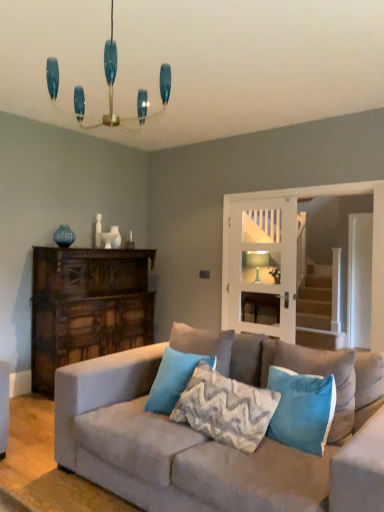
Where is `blank space above white glass door at center (from a real-world perspective)`? This screenshot has height=512, width=384. blank space above white glass door at center (from a real-world perspective) is located at coordinates (262, 197).